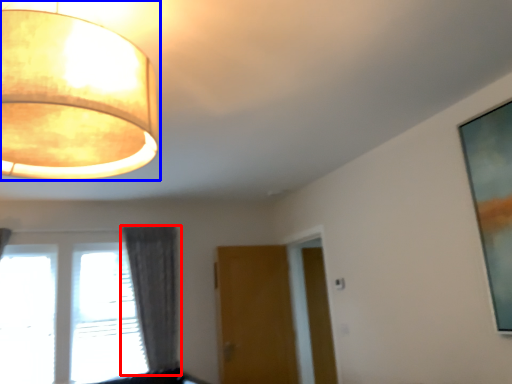
Question: Which object appears farthest to the camera in this image, curtain (highlighted by a red box) or lamp (highlighted by a blue box)?

Choices:
 (A) curtain
 (B) lamp

Answer: (A)